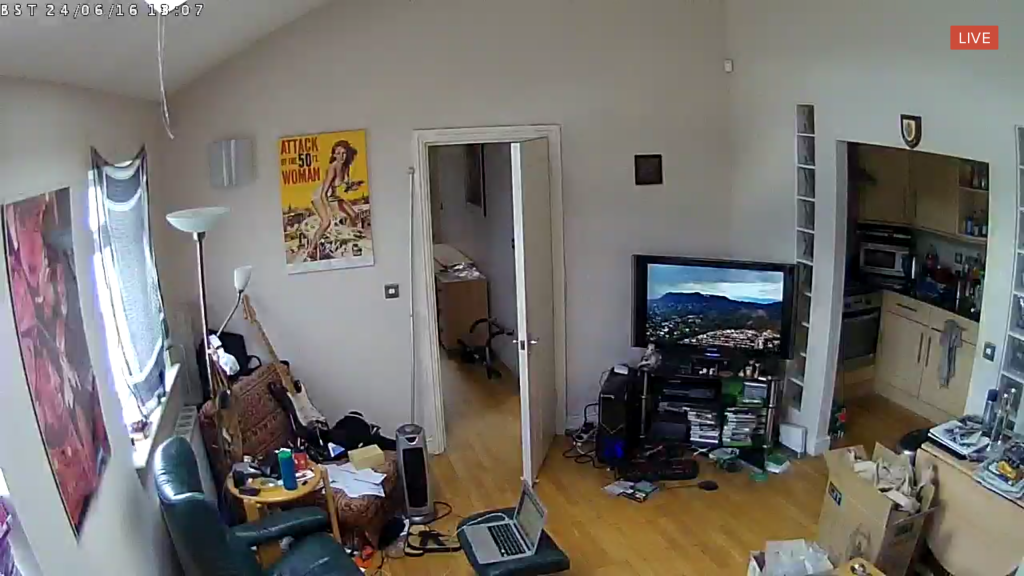
Where is `dresser`? The height and width of the screenshot is (576, 1024). dresser is located at coordinates (458, 294).